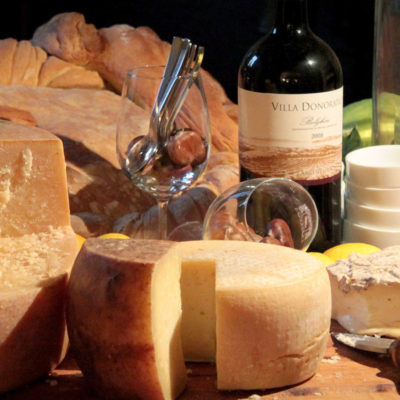
Where is `bowl`? bowl is located at coordinates (383, 220).